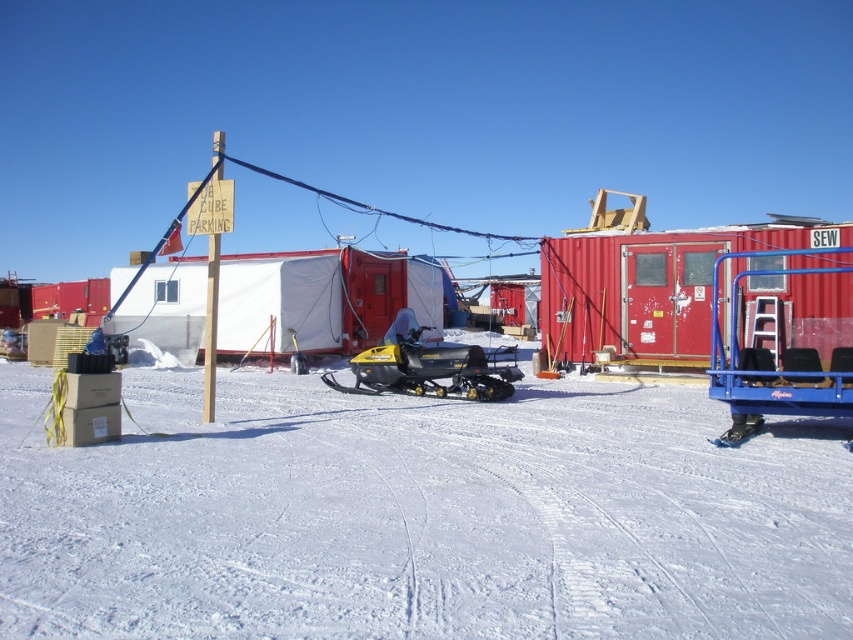
Which is above, white powdery snow at center or yellow matte snowmobile at center?

yellow matte snowmobile at center

Can you confirm if white powdery snow at center is smaller than yellow matte snowmobile at center?

No, white powdery snow at center is not smaller than yellow matte snowmobile at center.

The width and height of the screenshot is (853, 640). Find the location of `white powdery snow at center`. white powdery snow at center is located at coordinates (421, 516).

Find the location of `white powdery snow at center`. white powdery snow at center is located at coordinates (421, 516).